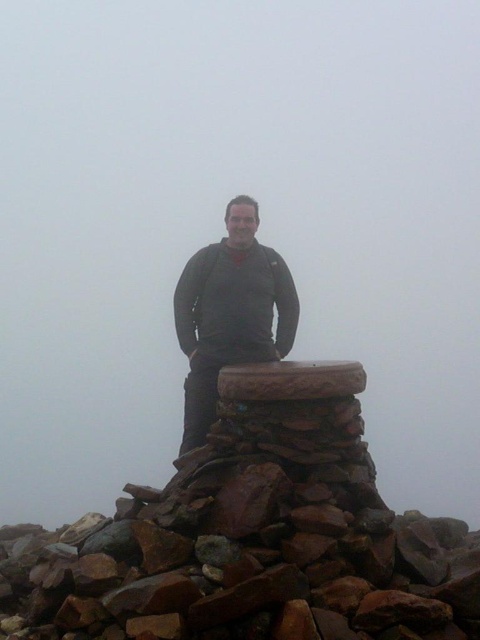
You are a hiker who wants to place your matte gray sweater at center on top of the brown rough stone at center. Based on the scene description, will the sweater fit on the stone?

The brown rough stone at center is bigger than matte gray sweater at center, so the sweater will fit on the stone.

You are a hiker who just reached the top of a mountain. You want to place a new stone on the brown rough stone at center to add to the cairn. The stone you have is 0.5 meters in diameter. Can you fit it on top?

The brown rough stone at center is 4.60 meters apart from the new stone you have. Since the distance between them is greater than the size of your stone, you cannot place it directly. You need to move closer first.